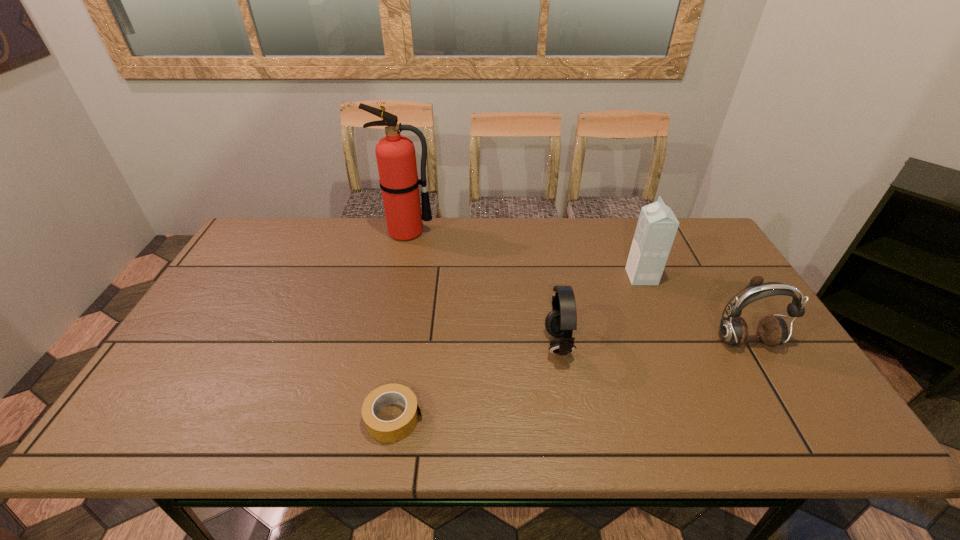
Where is `vacant space that is in between the nearest object and the second shortest object`? The width and height of the screenshot is (960, 540). vacant space that is in between the nearest object and the second shortest object is located at coordinates (476, 381).

The width and height of the screenshot is (960, 540). I want to click on unoccupied position between the third shortest object and the nearest object, so click(569, 380).

At what (x,y) coordinates should I click in order to perform the action: click on vacant region between the duct tape and the left earphone. Please return your answer as a coordinate pair (x, y). The height and width of the screenshot is (540, 960). Looking at the image, I should click on (476, 381).

Identify the location of free space between the fourth object from left to right and the rightmost object. (693, 309).

I want to click on free space between the second object from right to left and the tallest object, so click(x=524, y=254).

I want to click on blank region between the third object from right to left and the tallest object, so tap(483, 288).

Where is `free area in between the fourth nearest object and the second shortest object`? The width and height of the screenshot is (960, 540). free area in between the fourth nearest object and the second shortest object is located at coordinates (600, 310).

You are a GUI agent. You are given a task and a screenshot of the screen. Output one action in this format:
    pyautogui.click(x=<x>, y=<y>)
    Task: Click on the free space between the nearest object and the tallest object
    
    Given the screenshot: What is the action you would take?
    pyautogui.click(x=400, y=325)

This screenshot has height=540, width=960. What are the coordinates of `free space between the taller earphone and the nearest object` in the screenshot? It's located at (569, 380).

This screenshot has height=540, width=960. What are the coordinates of `object that is the third nearest to the left earphone` in the screenshot? It's located at (772, 330).